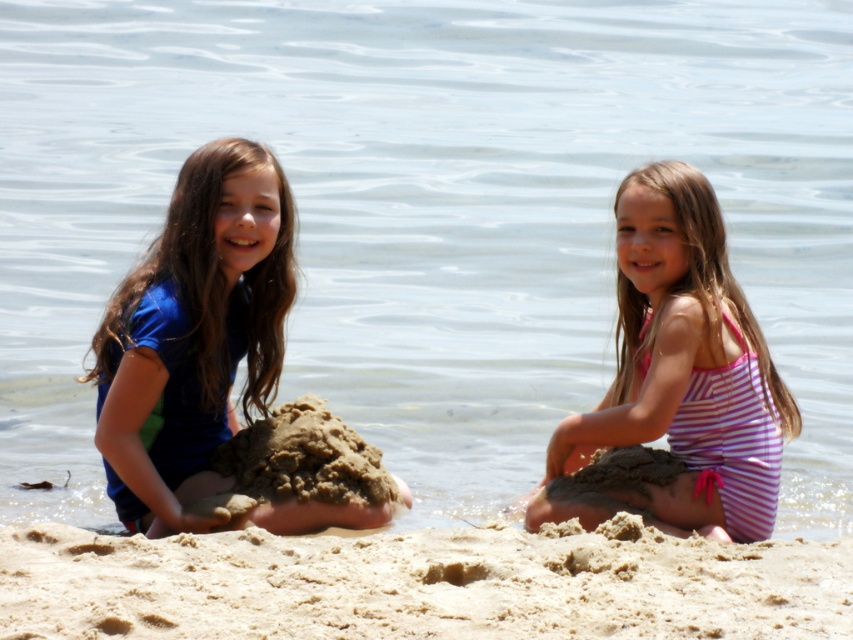
Question: Which object is farther from the camera taking this photo?

Choices:
 (A) pink striped swimsuit at center
 (B) fine-grained sand at lower center
 (C) blue fabric swimsuit at left

Answer: (C)

Question: Is fine-grained sand at lower center smaller than pink striped swimsuit at center?

Choices:
 (A) no
 (B) yes

Answer: (B)

Question: Can you confirm if fine-grained sand at lower center is wider than blue fabric swimsuit at left?

Choices:
 (A) no
 (B) yes

Answer: (B)

Question: Does fine-grained sand at lower center have a lesser width compared to pink striped swimsuit at center?

Choices:
 (A) no
 (B) yes

Answer: (A)

Question: Which point is farther from the camera taking this photo?

Choices:
 (A) 721,237
 (B) 167,540

Answer: (A)

Question: Which point is closer to the camera taking this photo?

Choices:
 (A) (166, 285)
 (B) (689, 310)
 (C) (811, 568)

Answer: (C)